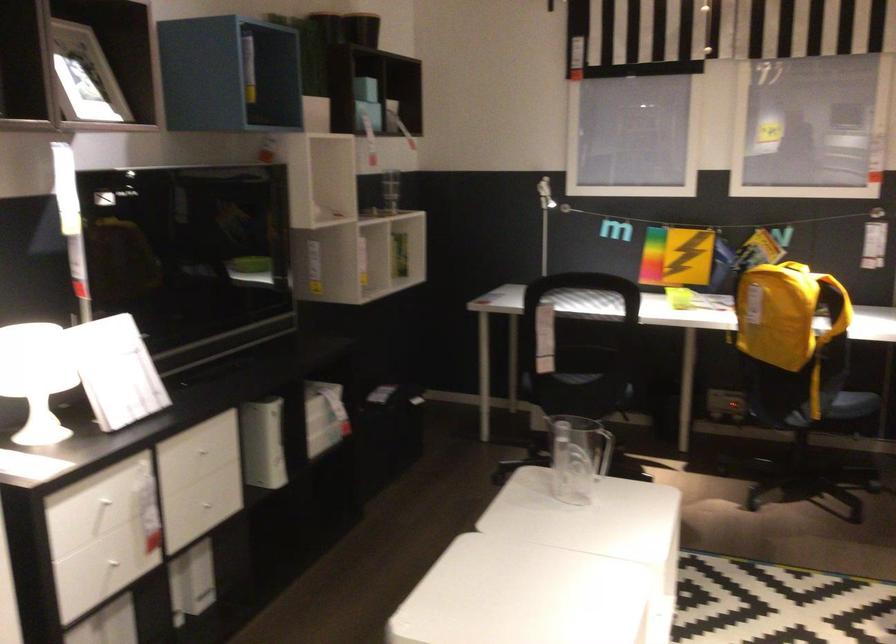
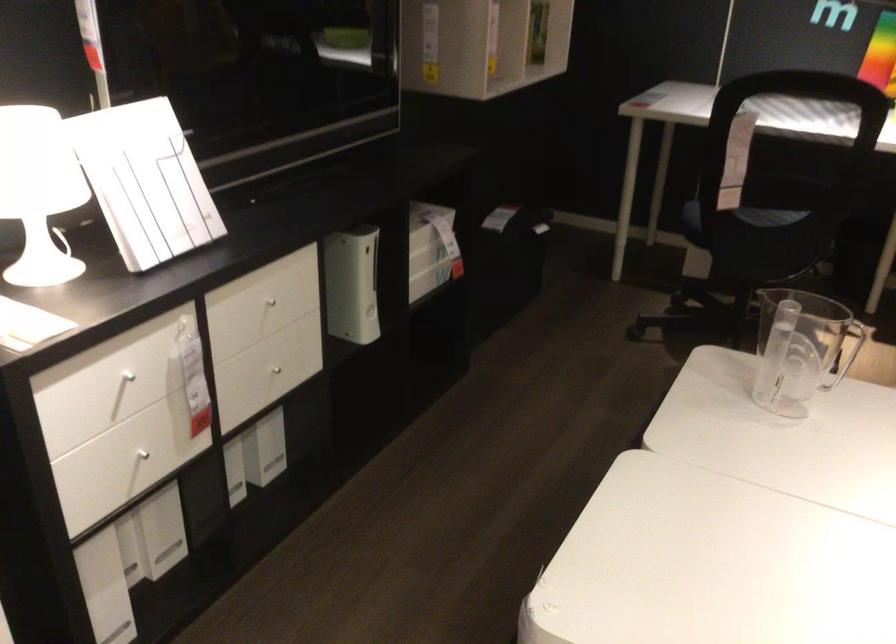
Where in the second image is the point corresponding to pixel 560 379 from the first image?

(739, 218)